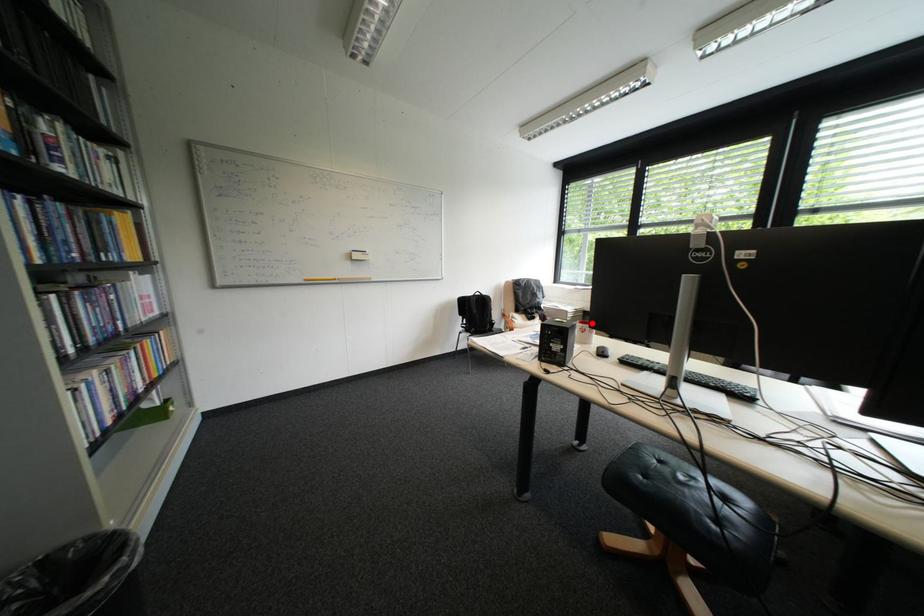
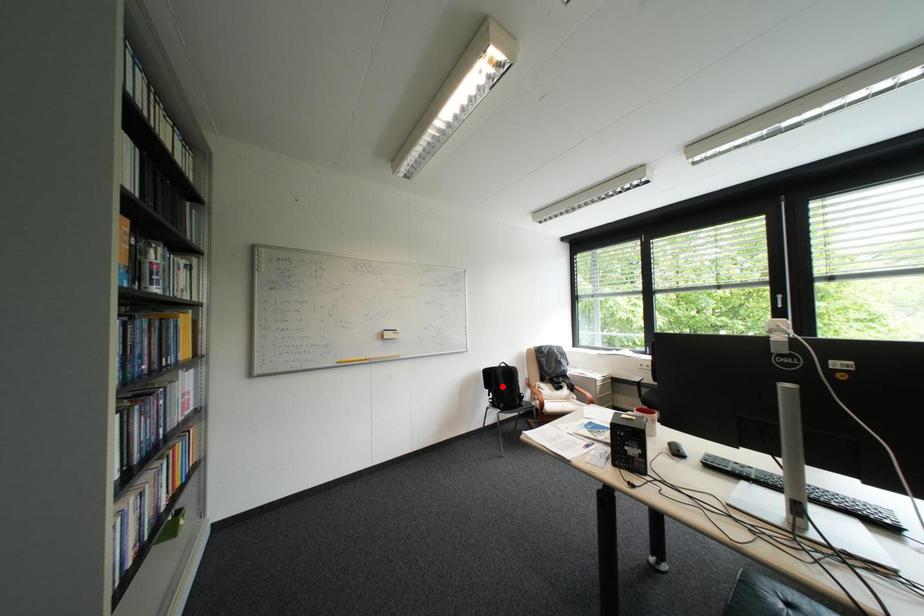
I am providing you with two images of the same scene from different viewpoints. A red point is marked on the first image and another point is marked on the second image. Do the highlighted points in image1 and image2 indicate the same real-world spot?

No